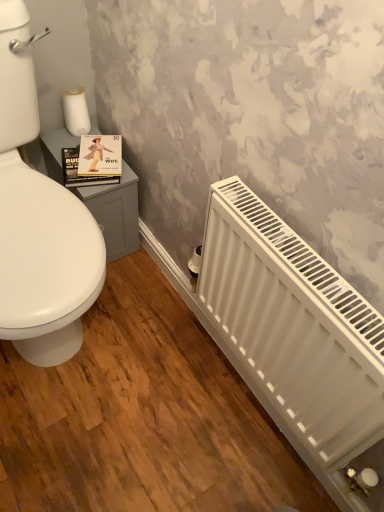
The image size is (384, 512). What are the coordinates of `vacant space situated above matte paper book at upper left (from a real-world perspective)` in the screenshot? It's located at (97, 158).